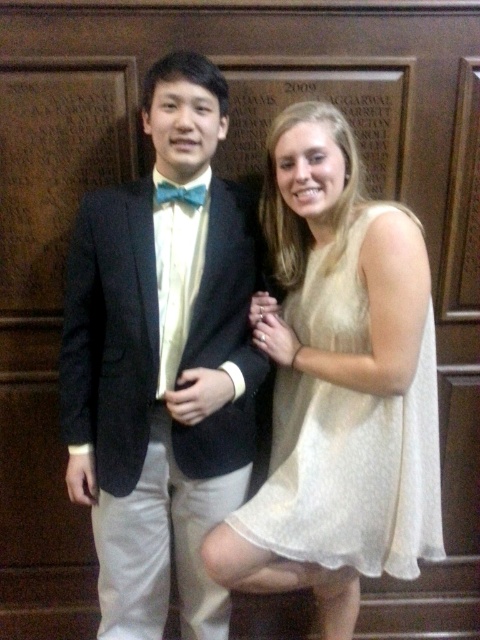
Is matte black suit at center smaller than white textured dress at center?

Incorrect, matte black suit at center is not smaller in size than white textured dress at center.

Does matte black suit at center come in front of white textured dress at center?

Yes, it is.

The image size is (480, 640). Describe the element at coordinates (162, 362) in the screenshot. I see `matte black suit at center` at that location.

What are the coordinates of `matte black suit at center` in the screenshot? It's located at (162, 362).

Measure the distance between point (373, 465) and camera.

4.58 feet

Who is more forward, (351, 465) or (173, 189)?

Point (173, 189) is in front.

What do you see at coordinates (351, 474) in the screenshot? This screenshot has width=480, height=640. I see `white textured dress at center` at bounding box center [351, 474].

You are a GUI agent. You are given a task and a screenshot of the screen. Output one action in this format:
    pyautogui.click(x=<x>, y=<y>)
    Task: Click on the white textured dress at center
    This screenshot has width=480, height=640.
    Given the screenshot: What is the action you would take?
    (x=351, y=474)

Can you confirm if matte black suit at center is bigger than blue satin bow tie at center?

Correct, matte black suit at center is larger in size than blue satin bow tie at center.

Can you confirm if matte black suit at center is positioned above blue satin bow tie at center?

Actually, matte black suit at center is below blue satin bow tie at center.

Does point (242, 291) come closer to viewer compared to point (194, 193)?

No, it is behind (194, 193).

Identify the location of matte black suit at center. The image size is (480, 640). (162, 362).